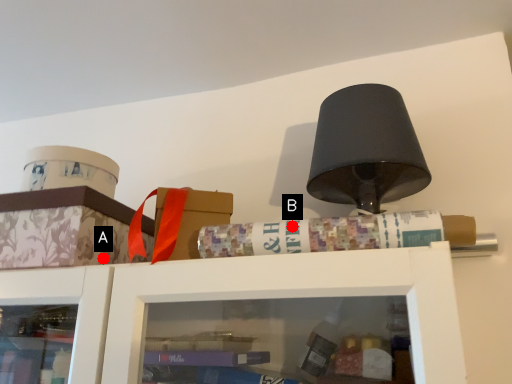
Question: Two points are circled on the image, labeled by A and B beside each circle. Which point is further to the camera?

Choices:
 (A) A is further
 (B) B is further

Answer: (A)